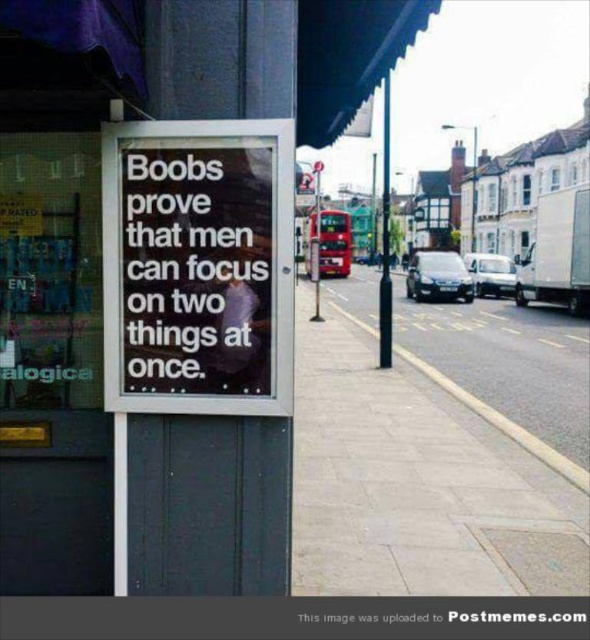
Question: Which point is closer to the camera taking this photo?

Choices:
 (A) pyautogui.click(x=209, y=408)
 (B) pyautogui.click(x=324, y=237)

Answer: (A)

Question: Which point is closer to the camera?

Choices:
 (A) (509, 548)
 (B) (283, 339)
 (C) (168, 157)

Answer: (C)

Question: Which of the following is the closest to the observer?

Choices:
 (A) black glass sign at center
 (B) gray concrete sidewalk at lower center

Answer: (A)

Question: Is black glass sign at center to the left of black paper at center from the viewer's perspective?

Choices:
 (A) no
 (B) yes

Answer: (A)

Question: Is gray concrete sidewalk at lower center further to the viewer compared to black paper at center?

Choices:
 (A) yes
 (B) no

Answer: (A)

Question: Does black glass sign at center have a lesser width compared to red metallic bus at center?

Choices:
 (A) no
 (B) yes

Answer: (B)